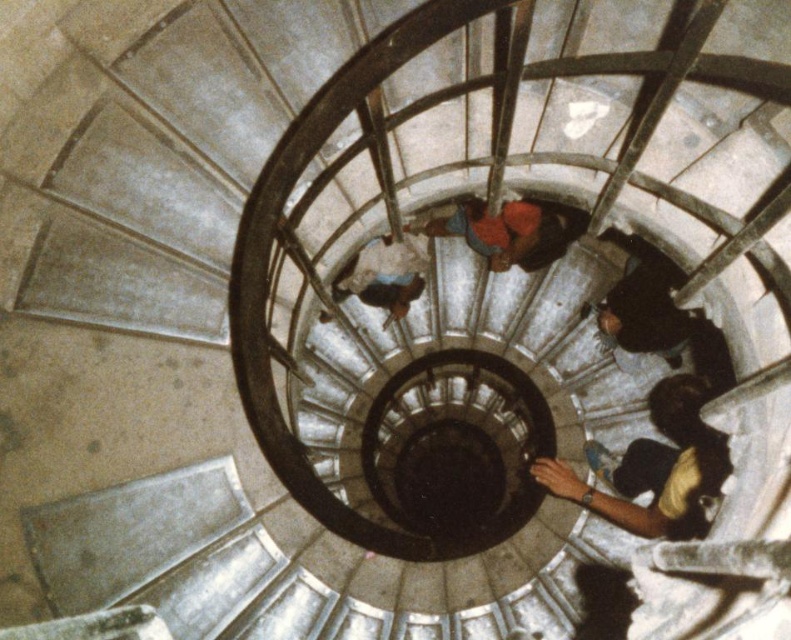
Who is more distant from viewer, (694, 467) or (335, 296)?

The point (335, 296) is more distant.

Is point (687, 440) positioned in front of point (365, 285)?

Yes.

Describe the element at coordinates (657, 467) in the screenshot. The height and width of the screenshot is (640, 791). I see `dark blue jeans at bottom right` at that location.

Locate an element on the screen. dark blue jeans at bottom right is located at coordinates (657, 467).

Is red fabric jacket at center wider than blue fabric at center?

Yes.

Is point (543, 240) closer to camera compared to point (380, 284)?

Yes, point (543, 240) is in front of point (380, 284).

Measure the distance between point (466,212) and camera.

Point (466,212) is 9.62 meters away from camera.

Find the location of a particular element. This screenshot has height=640, width=791. red fabric jacket at center is located at coordinates (509, 230).

Is dark blue jeans at bottom right taller than red fabric jacket at center?

Indeed, dark blue jeans at bottom right has a greater height compared to red fabric jacket at center.

Which is behind, point (651, 481) or point (534, 243)?

The point (534, 243) is behind.

Image resolution: width=791 pixels, height=640 pixels. Identify the location of dark blue jeans at bottom right. (657, 467).